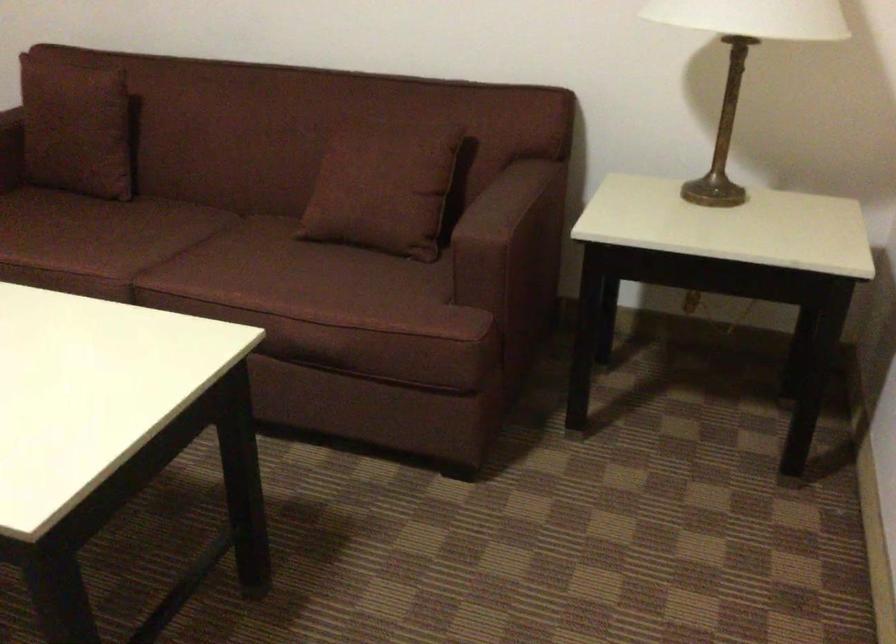
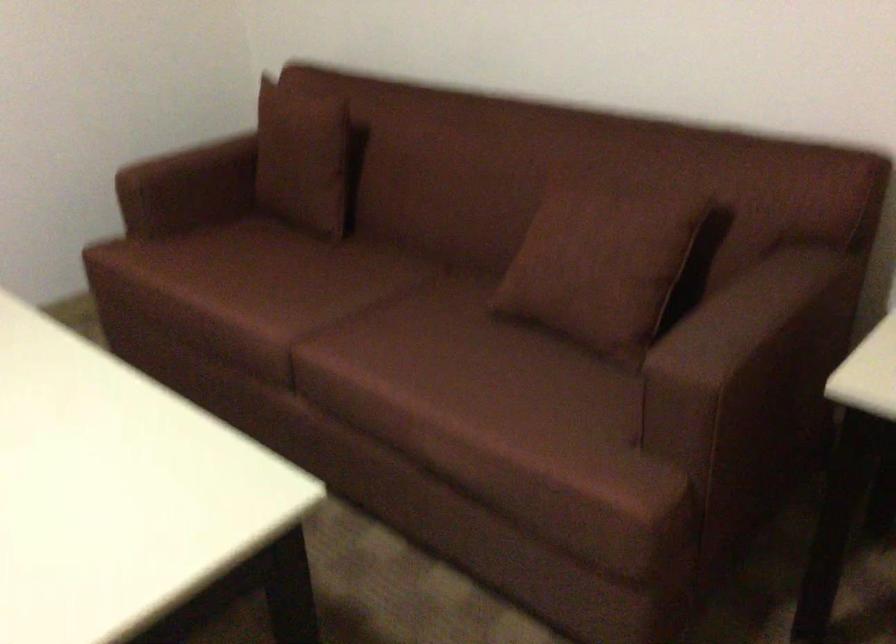
In the second image, find the point that corresponds to point 87,122 in the first image.

(306, 158)